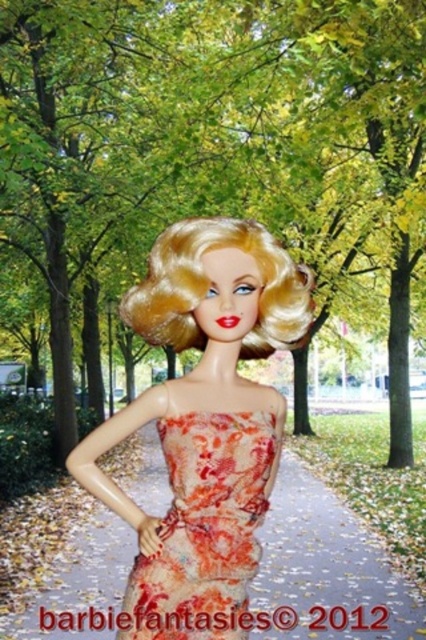
You are a photographer trying to capture the shiny plastic doll at center and the matte plastic pavement at center in a single shot. Which object will appear closer to the camera in the photo?

The shiny plastic doll at center will appear closer to the camera because it is positioned in front of the matte plastic pavement at center.